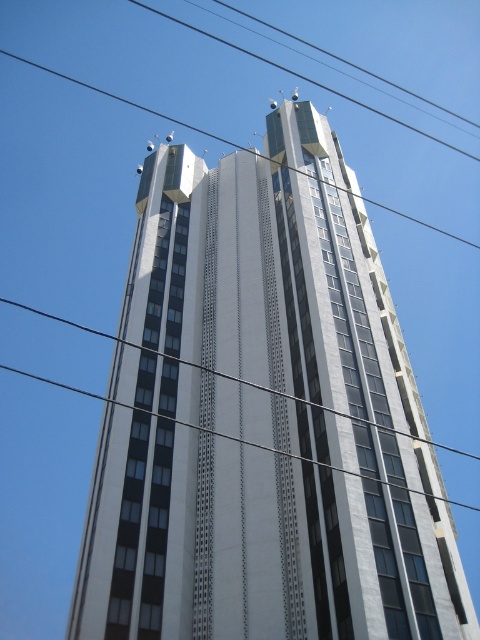
Is metallic wire at center positioned in front of black wire at upper center?

Yes, metallic wire at center is in front of black wire at upper center.

Which is above, metallic wire at center or black wire at upper center?

black wire at upper center is higher up.

Measure the distance between point [32,307] and camera.

Point [32,307] and camera are 252.19 meters apart from each other.

Locate an element on the screen. metallic wire at center is located at coordinates (263, 388).

Can you confirm if white glass building at center is shorter than black wire at upper center?

Yes.

Does white glass building at center lie in front of black wire at upper center?

Yes, white glass building at center is in front of black wire at upper center.

The image size is (480, 640). I want to click on white glass building at center, so click(x=264, y=419).

Between white glass building at center and metallic wire at center, which one has less height?

Standing shorter between the two is white glass building at center.

Does white glass building at center have a lesser height compared to metallic wire at center?

Yes, white glass building at center is shorter than metallic wire at center.

Which is in front, point (326, 412) or point (406, 490)?

Point (406, 490)

Locate an element on the screen. This screenshot has height=640, width=480. white glass building at center is located at coordinates (264, 419).